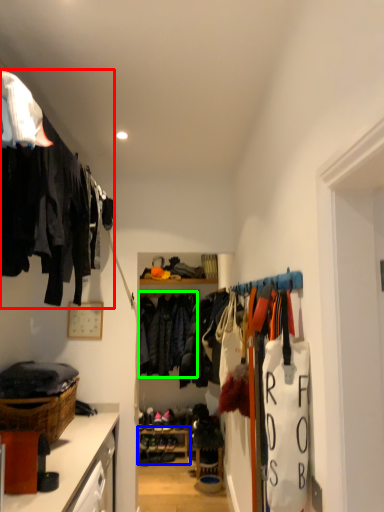
Question: Estimate the real-world distances between objects in this image. Which object is farther from closet (highlighted by a red box), shelf (highlighted by a blue box) or clothing (highlighted by a green box)?

Choices:
 (A) shelf
 (B) clothing

Answer: (A)